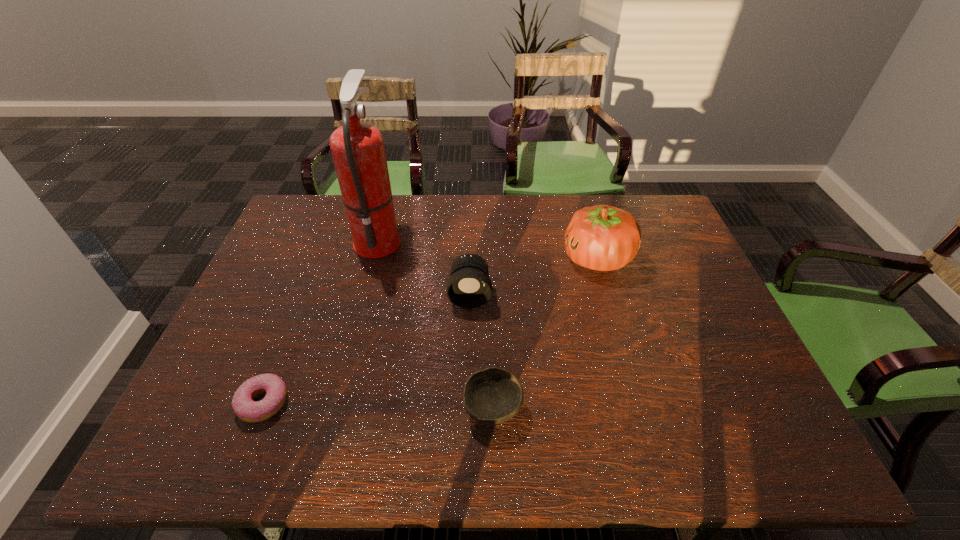
This screenshot has height=540, width=960. Find the location of `vacant region that satisfies the following two spatial constraints: 1. on the side of the rightmost object with the cute face; 2. on the front side of the bowl`. vacant region that satisfies the following two spatial constraints: 1. on the side of the rightmost object with the cute face; 2. on the front side of the bowl is located at coordinates (640, 408).

Identify the location of free space that satisfies the following two spatial constraints: 1. with the handle and hose on the second object from left to right; 2. on the back side of the bowl. This screenshot has height=540, width=960. [x=334, y=408].

Find the location of a particular element. The height and width of the screenshot is (540, 960). free spot that satisfies the following two spatial constraints: 1. on the side of the second tallest object with the cute face; 2. on the front side of the bowl is located at coordinates (640, 408).